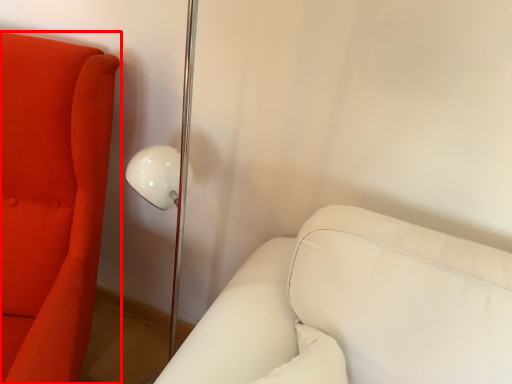
Question: From the image's perspective, what is the correct spatial relationship of furniture (annotated by the red box) in relation to furniture?

Choices:
 (A) above
 (B) below

Answer: (A)